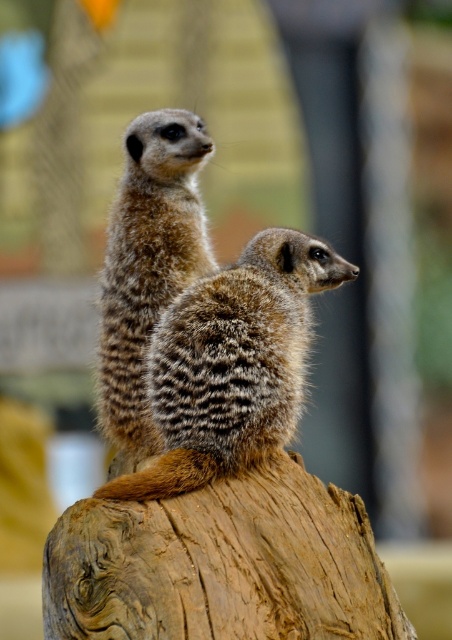
Question: Is brown fuzzy meerkat at center smaller than fuzzy brown meerkat at upper left?

Choices:
 (A) no
 (B) yes

Answer: (A)

Question: Can you confirm if brown fuzzy meerkat at center is smaller than fuzzy brown meerkat at upper left?

Choices:
 (A) no
 (B) yes

Answer: (A)

Question: Which of the following is the farthest from the observer?

Choices:
 (A) fuzzy brown meerkat at upper left
 (B) brown fuzzy meerkat at center

Answer: (A)

Question: In this image, where is brown fuzzy meerkat at center located relative to fuzzy brown meerkat at upper left?

Choices:
 (A) left
 (B) right

Answer: (B)

Question: Which object is closer to the camera taking this photo?

Choices:
 (A) brown fuzzy meerkat at center
 (B) fuzzy brown meerkat at upper left

Answer: (A)

Question: Which point is farther from the camera taking this photo?

Choices:
 (A) (132, 333)
 (B) (268, 396)

Answer: (A)